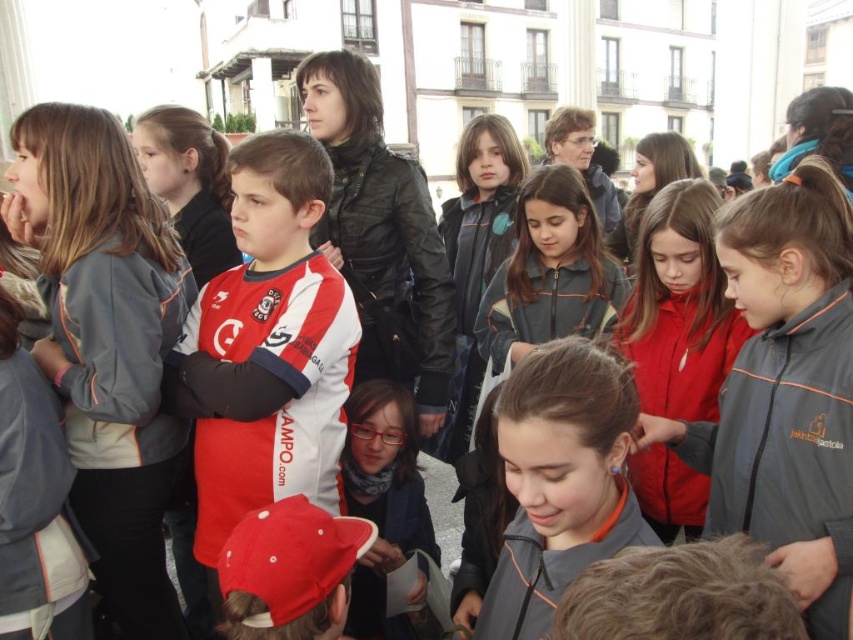
Question: Can you confirm if gray fabric jacket at center is positioned below red and white jersey at center?

Choices:
 (A) yes
 (B) no

Answer: (A)

Question: Which of these objects is positioned farthest from the gray matte jacket at center?

Choices:
 (A) gray fabric jacket at center
 (B) red and white jersey at center

Answer: (B)

Question: Does gray fabric jacket at center lie in front of red and white jersey at center?

Choices:
 (A) no
 (B) yes

Answer: (B)

Question: Among these points, which one is farthest from the camera?

Choices:
 (A) (230, 397)
 (B) (90, 436)
 (C) (827, 198)
 (D) (558, 460)

Answer: (B)

Question: Does gray fabric jacket at center have a smaller size compared to red and white jersey at center?

Choices:
 (A) yes
 (B) no

Answer: (A)

Question: Among these objects, which one is nearest to the camera?

Choices:
 (A) red and white jersey at center
 (B) gray fleece jacket at left
 (C) gray fabric jacket at center
 (D) gray matte jacket at center

Answer: (C)